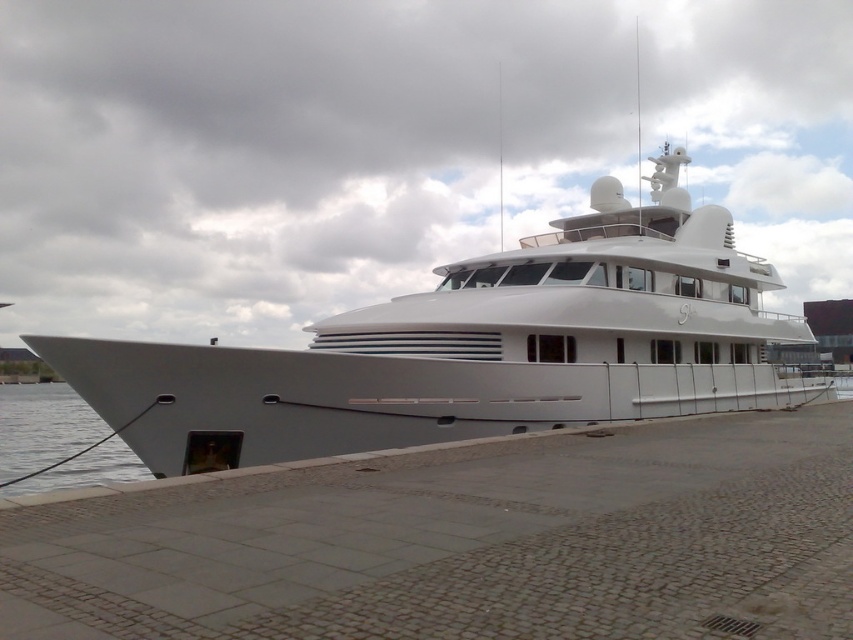
You are standing on the pier and want to take a photo of the white glossy yacht at center and the clear water at lower left. Which object should you focus on first if you want to capture both in the same frame without moving the camera?

You should focus on the white glossy yacht at center first because it is closer to you than the clear water at lower left, allowing both to be in focus when using a camera with a large depth of field.

You are standing on the pier and notice the white glossy yacht at center and the clear water at lower left. Which object is positioned higher relative to the other?

The white glossy yacht at center is above clear water at lower left, so it is positioned higher.